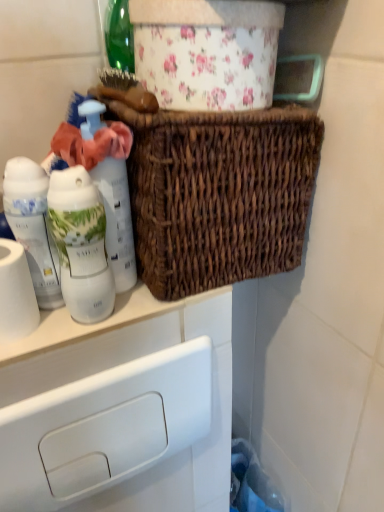
The image size is (384, 512). What do you see at coordinates (104, 426) in the screenshot?
I see `white plastic drawer at lower left` at bounding box center [104, 426].

Find the location of a particular element. Image resolution: width=384 pixels, height=512 pixels. white glossy lotion at left, placed as the 3th bottle when sorted from right to left is located at coordinates (33, 226).

What do you see at coordinates (81, 244) in the screenshot? I see `white glossy bottle at left, arranged as the second bottle when viewed from the left` at bounding box center [81, 244].

The height and width of the screenshot is (512, 384). Find the location of `white matte toilet paper at left`. white matte toilet paper at left is located at coordinates pyautogui.click(x=16, y=293).

In the scene shown: Considering the relative sizes of white plastic drawer at lower left and white matte toilet paper at left in the image provided, is white plastic drawer at lower left smaller than white matte toilet paper at left?

No.

Relative to white matte toilet paper at left, is white plastic drawer at lower left in front or behind?

white plastic drawer at lower left is positioned farther from the viewer than white matte toilet paper at left.

Is white plastic drawer at lower left oriented away from white matte toilet paper at left?

That's not correct — white plastic drawer at lower left is not looking away from white matte toilet paper at left.

Based on the photo, from the image's perspective, is white glossy lotion at left, placed as the 3th bottle when sorted from right to left, positioned above or below white matte toilet paper at left?

white glossy lotion at left, placed as the 3th bottle when sorted from right to left, is above white matte toilet paper at left.

Could you tell me if white glossy lotion at left, placed as the 3th bottle when sorted from right to left, is facing white matte toilet paper at left?

No, white glossy lotion at left, placed as the 3th bottle when sorted from right to left, does not turn towards white matte toilet paper at left.

Can you confirm if white glossy lotion at left, placed as the 3th bottle when sorted from right to left, is wider than white matte toilet paper at left?

In fact, white glossy lotion at left, placed as the 3th bottle when sorted from right to left, might be narrower than white matte toilet paper at left.

Consider the image. Is woven brown basket at upper center shorter than white glossy bottle at left, arranged as the second bottle when viewed from the left?

No.

Is woven brown basket at upper center beside white glossy bottle at left, arranged as the second bottle when viewed from the left?

They are not placed beside each other.

Is woven brown basket at upper center to the left of white glossy bottle at left, arranged as the second bottle when viewed from the left, from the viewer's perspective?

No, woven brown basket at upper center is not to the left of white glossy bottle at left, arranged as the second bottle when viewed from the left.

Which bottle is the 2nd one when counting from the front of the white plastic drawer at lower left? Please provide its 2D coordinates.

[(33, 226)]

Does white plastic drawer at lower left lie in front of white glossy lotion at left, arranged as the first bottle when viewed from the left?

No, the depth of white plastic drawer at lower left is greater than that of white glossy lotion at left, arranged as the first bottle when viewed from the left.

Considering the sizes of objects white plastic drawer at lower left and white glossy lotion at left, arranged as the first bottle when viewed from the left, in the image provided, who is thinner, white plastic drawer at lower left or white glossy lotion at left, arranged as the first bottle when viewed from the left,?

Thinner between the two is white plastic drawer at lower left.

Based on the photo, is the surface of woven brown basket at upper center in direct contact with white matte toilet paper at left?

No, woven brown basket at upper center is not next to white matte toilet paper at left.

Between point (218, 188) and point (22, 250), which one is positioned in front?

The point (22, 250) is more forward.

From the image's perspective, which is above, woven brown basket at upper center or white matte toilet paper at left?

woven brown basket at upper center.

Where is `picnic basket that is above the white matte toilet paper at left (from the image's perspective)`? picnic basket that is above the white matte toilet paper at left (from the image's perspective) is located at coordinates (217, 193).

Is white glossy bottle at left, positioned as the second bottle in right-to-left order, in front of or behind white plastic drawer at lower left in the image?

In the image, white glossy bottle at left, positioned as the second bottle in right-to-left order, appears in front of white plastic drawer at lower left.

From a real-world perspective, is white glossy bottle at left, positioned as the second bottle in right-to-left order, on top of white plastic drawer at lower left?

Yes, from a real-world perspective, white glossy bottle at left, positioned as the second bottle in right-to-left order, is over white plastic drawer at lower left

How many degrees apart are the facing directions of white glossy bottle at left, arranged as the second bottle when viewed from the left, and white plastic drawer at lower left?

The angular difference between white glossy bottle at left, arranged as the second bottle when viewed from the left, and white plastic drawer at lower left is 1.69 degrees.

Which is closer to the camera, (75, 188) or (92, 397)?

The point (75, 188) is in front.

From a real-world perspective, relative to woven brown basket at upper center, is white glossy lotion at left, arranged as the first bottle when viewed from the left, vertically above or below?

From a real-world perspective, white glossy lotion at left, arranged as the first bottle when viewed from the left, is physically below woven brown basket at upper center.

From the image's perspective, between white glossy lotion at left, placed as the 3th bottle when sorted from right to left, and woven brown basket at upper center, who is located below?

From the image's view, white glossy lotion at left, placed as the 3th bottle when sorted from right to left, is below.

Could woven brown basket at upper center be considered to be inside white glossy lotion at left, placed as the 3th bottle when sorted from right to left?

Actually, woven brown basket at upper center is outside white glossy lotion at left, placed as the 3th bottle when sorted from right to left.

Between white glossy lotion at left, arranged as the first bottle when viewed from the left, and woven brown basket at upper center, which one has less height?

white glossy lotion at left, arranged as the first bottle when viewed from the left.

At what (x,y) coordinates should I click in order to perform the action: click on toilet paper above the white plastic drawer at lower left (from the image's perspective). Please return your answer as a coordinate pair (x, y). Image resolution: width=384 pixels, height=512 pixels. Looking at the image, I should click on (16, 293).

Image resolution: width=384 pixels, height=512 pixels. Find the location of `toilet paper in front of the white glossy lotion at left, placed as the 3th bottle when sorted from right to left`. toilet paper in front of the white glossy lotion at left, placed as the 3th bottle when sorted from right to left is located at coordinates (16, 293).

From the image, which object appears to be farther from white matte bottle at left, marked as the 1th bottle in a right-to-left arrangement, white matte toilet paper at left or white glossy bottle at left, arranged as the second bottle when viewed from the left?

The object further to white matte bottle at left, marked as the 1th bottle in a right-to-left arrangement, is white matte toilet paper at left.

Based on their spatial positions, is white glossy lotion at left, placed as the 3th bottle when sorted from right to left, or woven brown basket at upper center closer to white matte toilet paper at left?

white glossy lotion at left, placed as the 3th bottle when sorted from right to left, is closer to white matte toilet paper at left.

From the image, which object appears to be nearer to white plastic drawer at lower left, woven brown basket at upper center or white matte toilet paper at left?

white matte toilet paper at left is closer to white plastic drawer at lower left.

Looking at the image, which one is located further to white glossy bottle at left, arranged as the second bottle when viewed from the left, white glossy lotion at left, arranged as the first bottle when viewed from the left, or white matte bottle at left, marked as the 1th bottle in a right-to-left arrangement?

Based on the image, white matte bottle at left, marked as the 1th bottle in a right-to-left arrangement, appears to be further to white glossy bottle at left, arranged as the second bottle when viewed from the left.

When comparing their distances from white matte bottle at left, marked as the 1th bottle in a right-to-left arrangement, does white plastic drawer at lower left or white glossy bottle at left, arranged as the second bottle when viewed from the left, seem further?

The object further to white matte bottle at left, marked as the 1th bottle in a right-to-left arrangement, is white plastic drawer at lower left.

Which object lies further to the anchor point woven brown basket at upper center, white glossy bottle at left, positioned as the second bottle in right-to-left order, or white matte toilet paper at left?

Based on the image, white matte toilet paper at left appears to be further to woven brown basket at upper center.

When comparing their distances from woven brown basket at upper center, does white matte bottle at left, the third bottle from the left, or white glossy lotion at left, placed as the 3th bottle when sorted from right to left, seem further?

white glossy lotion at left, placed as the 3th bottle when sorted from right to left, is positioned further to the anchor woven brown basket at upper center.

Looking at the image, which one is located closer to woven brown basket at upper center, white glossy lotion at left, arranged as the first bottle when viewed from the left, or white glossy bottle at left, arranged as the second bottle when viewed from the left?

white glossy bottle at left, arranged as the second bottle when viewed from the left, is closer to woven brown basket at upper center.

Where is `toilet paper between white matte bottle at left, marked as the 1th bottle in a right-to-left arrangement, and white plastic drawer at lower left in the up-down direction`? toilet paper between white matte bottle at left, marked as the 1th bottle in a right-to-left arrangement, and white plastic drawer at lower left in the up-down direction is located at coordinates (16, 293).

Where is `toilet paper between woven brown basket at upper center and white plastic drawer at lower left from top to bottom`? toilet paper between woven brown basket at upper center and white plastic drawer at lower left from top to bottom is located at coordinates (16, 293).

You are a GUI agent. You are given a task and a screenshot of the screen. Output one action in this format:
    pyautogui.click(x=<x>, y=<y>)
    Task: Click on the toilet paper that lies between white glossy lotion at left, arranged as the first bottle when viewed from the left, and white plastic drawer at lower left from top to bottom
    The width and height of the screenshot is (384, 512).
    Given the screenshot: What is the action you would take?
    pyautogui.click(x=16, y=293)

Where is `bottle between white glossy lotion at left, arranged as the first bottle when viewed from the left, and white matte bottle at left, marked as the 1th bottle in a right-to-left arrangement`? bottle between white glossy lotion at left, arranged as the first bottle when viewed from the left, and white matte bottle at left, marked as the 1th bottle in a right-to-left arrangement is located at coordinates (81, 244).